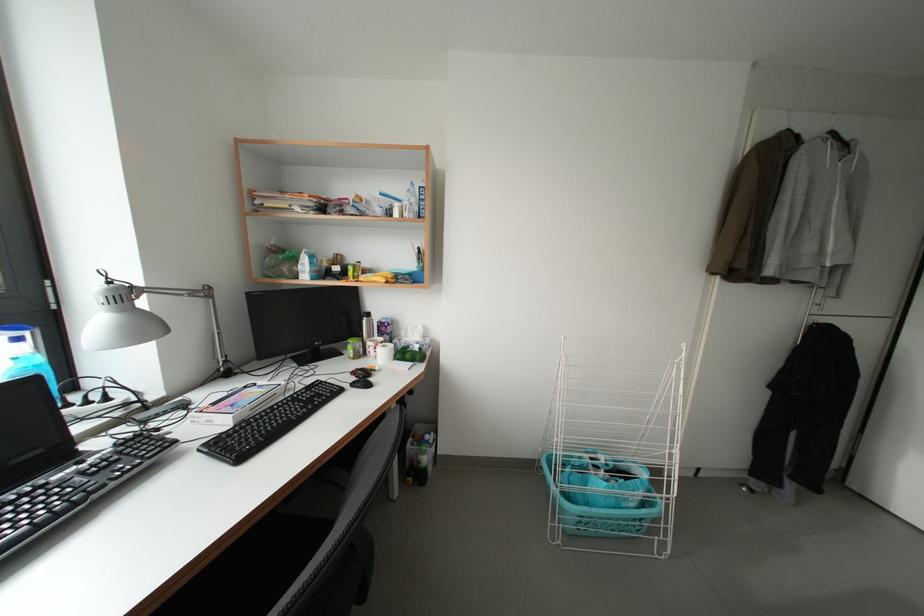
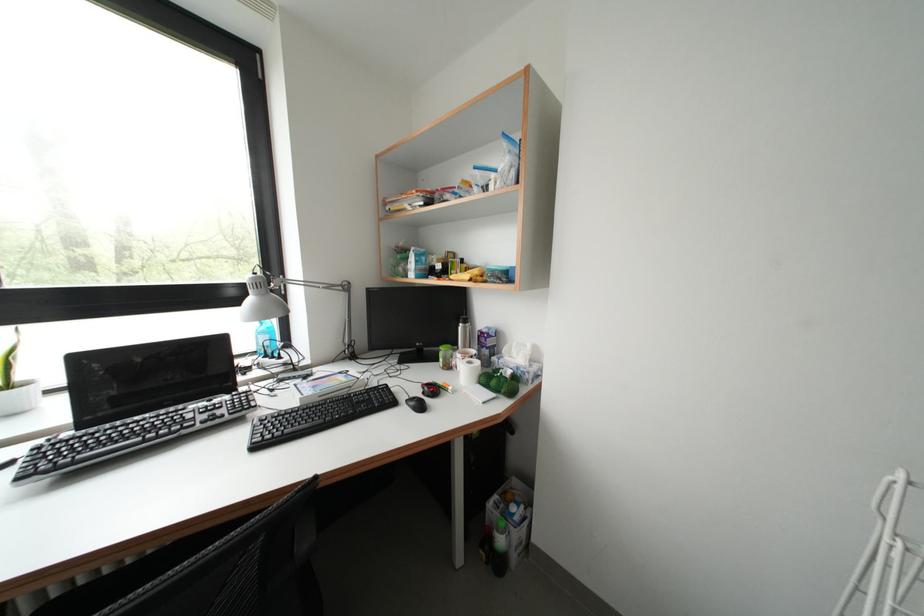
Question: The camera is either moving clockwise (left) or counter-clockwise (right) around the object. The first image is from the beginning of the video and the second image is from the end. Is the camera moving left or right when shooting the video?

Choices:
 (A) Left
 (B) Right

Answer: (B)